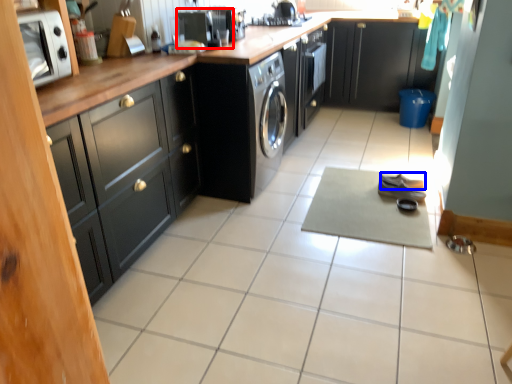
Question: Which object appears farthest to the camera in this image, appliance (highlighted by a red box) or shoe (highlighted by a blue box)?

Choices:
 (A) appliance
 (B) shoe

Answer: (B)